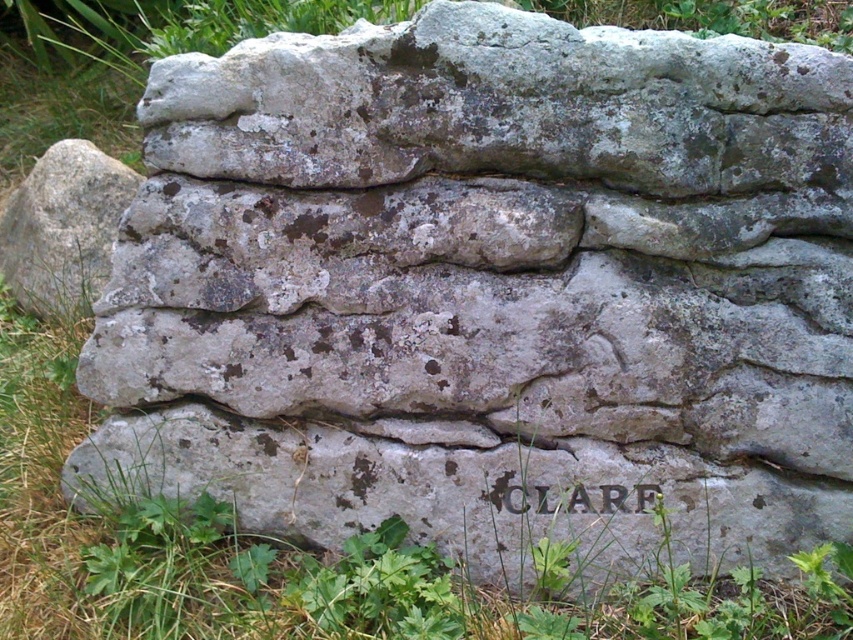
Question: Which point is closer to the camera?

Choices:
 (A) (68, 262)
 (B) (572, 496)

Answer: (B)

Question: Can you confirm if gray rough stone at left is wider than carved stone lettering at center?

Choices:
 (A) no
 (B) yes

Answer: (B)

Question: Does gray rough stone at left appear over carved stone lettering at center?

Choices:
 (A) no
 (B) yes

Answer: (B)

Question: Where is gray rough stone at left located in relation to carved stone lettering at center in the image?

Choices:
 (A) above
 (B) below

Answer: (A)